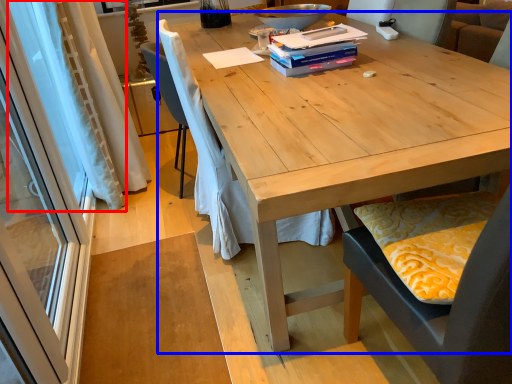
Question: Which of the following is the farthest to the observer, curtain (highlighted by a red box) or desk (highlighted by a blue box)?

Choices:
 (A) curtain
 (B) desk

Answer: (A)